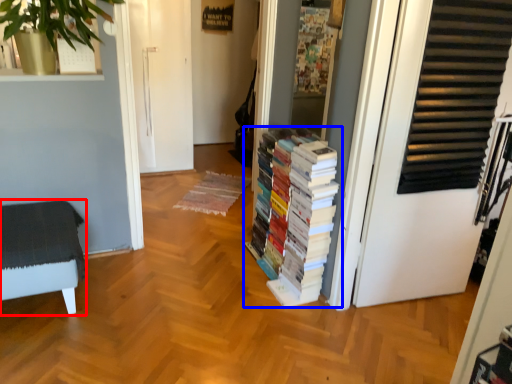
Question: Which point is further to the camera, furniture (highlighted by a red box) or book (highlighted by a blue box)?

Choices:
 (A) furniture
 (B) book

Answer: (B)